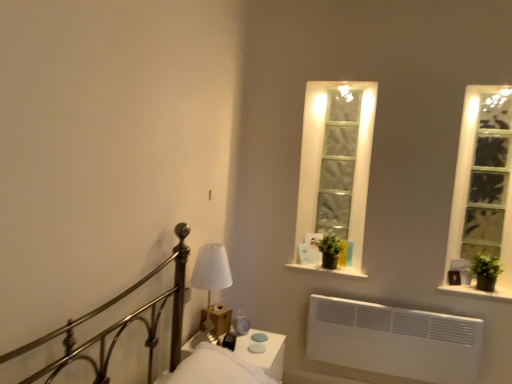
Describe the element at coordinates (479, 291) in the screenshot. I see `green matte plant at right, acting as the second window sill starting from the top` at that location.

How much space does black matte window sill at center, the 1th window sill in the left-to-right sequence, occupy horizontally?

The width of black matte window sill at center, the 1th window sill in the left-to-right sequence, is 11.52 inches.

At what (x,y) coordinates should I click in order to perform the action: click on metallic bed at left. Please return your answer as a coordinate pair (x, y). Looking at the image, I should click on (120, 325).

Is green matte plant at right, the 1th plant from the right, oriented away from green matte plant at right, acting as the second window sill starting from the top?

No, green matte plant at right, the 1th plant from the right, is not facing the opposite direction of green matte plant at right, acting as the second window sill starting from the top.

From the image's perspective, would you say green matte plant at right, which appears as the 2th plant when viewed from the back, is shown under green matte plant at right, which ranks as the 2th window sill in left-to-right order?

No, from the image's perspective, green matte plant at right, which appears as the 2th plant when viewed from the back, is not beneath green matte plant at right, which ranks as the 2th window sill in left-to-right order.

Consider the image. Measure the distance between green matte plant at right, the 1th plant from the right, and green matte plant at right, which is the first window sill in right-to-left order.

3.87 inches.

From a real-world perspective, is green matte plant at right, which appears as the first plant when viewed from the front, physically above green matte plant at right, which ranks as the 2th window sill in left-to-right order?

Yes.

Which of these two, green matte plant at right, the 1th window sill positioned from the bottom, or white fabric lampshade at center, is thinner?

white fabric lampshade at center is thinner.

Based on the photo, looking at the image, does green matte plant at right, which ranks as the 2th window sill in left-to-right order, seem bigger or smaller compared to white fabric lampshade at center?

In the image, green matte plant at right, which ranks as the 2th window sill in left-to-right order, appears to be smaller than white fabric lampshade at center.

Is green matte plant at right, which is the first window sill in right-to-left order, not near white fabric lampshade at center?

Yes.

Considering the relative positions of metallic bed at left and black matte window sill at center, the 1th window sill when ordered from top to bottom, in the image provided, is metallic bed at left to the left or to the right of black matte window sill at center, the 1th window sill when ordered from top to bottom,?

From the image, it's evident that metallic bed at left is to the left of black matte window sill at center, the 1th window sill when ordered from top to bottom.

Locate an element on the screen. The image size is (512, 384). bed below the black matte window sill at center, which appears as the 2th window sill when viewed from the right (from the image's perspective) is located at coordinates (120, 325).

Is point (170, 288) farther from viewer compared to point (364, 274)?

No, it is not.

From the image's perspective, starting from the black matte window sill at center, the 1th window sill in the left-to-right sequence, which plant is the 2nd one above? Please provide its 2D coordinates.

[(332, 251)]

From the image's perspective, who appears lower, black matte window sill at center, the 2th window sill from the bottom, or green matte plant at center, arranged as the second plant when viewed from the front?

black matte window sill at center, the 2th window sill from the bottom, is shown below in the image.

From the picture: Is black matte window sill at center, the 1th window sill when ordered from top to bottom, thinner than green matte plant at center, the first plant positioned from the back?

Incorrect, the width of black matte window sill at center, the 1th window sill when ordered from top to bottom, is not less than that of green matte plant at center, the first plant positioned from the back.

Between black matte window sill at center, the 1th window sill in the left-to-right sequence, and green matte plant at center, arranged as the second plant when viewed from the front, which one has smaller size?

green matte plant at center, arranged as the second plant when viewed from the front, is smaller.

Is metallic bed at left located outside white glossy nightstand at lower center?

Yes, metallic bed at left is located beyond the bounds of white glossy nightstand at lower center.

Is metallic bed at left directly adjacent to white glossy nightstand at lower center?

No.

From the picture: Does metallic bed at left have a smaller size compared to white glossy nightstand at lower center?

Incorrect, metallic bed at left is not smaller in size than white glossy nightstand at lower center.

Does green matte plant at center, arranged as the second plant when viewed from the front, have a smaller size compared to white glossy nightstand at lower center?

Indeed, green matte plant at center, arranged as the second plant when viewed from the front, has a smaller size compared to white glossy nightstand at lower center.

Could you measure the distance between green matte plant at center, the 2th plant viewed from the right, and white glossy nightstand at lower center?

green matte plant at center, the 2th plant viewed from the right, and white glossy nightstand at lower center are 31.70 inches apart from each other.

Which is behind, green matte plant at center, arranged as the second plant when viewed from the front, or white glossy nightstand at lower center?

Positioned behind is green matte plant at center, arranged as the second plant when viewed from the front.

Considering the relative positions of green matte plant at center, arranged as the second plant when viewed from the front, and white glossy nightstand at lower center in the image provided, is green matte plant at center, arranged as the second plant when viewed from the front, to the right of white glossy nightstand at lower center from the viewer's perspective?

Indeed, green matte plant at center, arranged as the second plant when viewed from the front, is positioned on the right side of white glossy nightstand at lower center.

Image resolution: width=512 pixels, height=384 pixels. What are the coordinates of `plant that is the 1st object located below the clear glass window at right (from the image's perspective)` in the screenshot? It's located at (332, 251).

Would you say green matte plant at center, arranged as the second plant when viewed from the front, contains clear glass window at right?

No, clear glass window at right is not inside green matte plant at center, arranged as the second plant when viewed from the front.

Which of these two, green matte plant at center, the 2th plant viewed from the right, or clear glass window at right, is wider?

Wider between the two is clear glass window at right.

From the image's perspective, is green matte plant at center, arranged as the second plant when viewed from the front, under clear glass window at right?

Yes.

You are a GUI agent. You are given a task and a screenshot of the screen. Output one action in this format:
    pyautogui.click(x=<x>, y=<y>)
    Task: Click on the 1st window sill counting from the left of the green matte plant at right, which appears as the first plant when viewed from the front
    
    Given the screenshot: What is the action you would take?
    pyautogui.click(x=479, y=291)

Locate an element on the screen. This screenshot has height=384, width=512. the 2nd window sill to the right of the white fabric lampshade at center, starting your count from the anchor is located at coordinates (479, 291).

Looking at the image, which one is located closer to green matte plant at right, the 1th plant from the right, green matte plant at right, which is the first window sill in right-to-left order, or green matte plant at center, the first plant positioned from the back?

green matte plant at right, which is the first window sill in right-to-left order.

Which object lies further to the anchor point green matte plant at right, which appears as the 2th plant when viewed from the back, green matte plant at center, which is counted as the 1th plant, starting from the left, or metallic bed at left?

Based on the image, metallic bed at left appears to be further to green matte plant at right, which appears as the 2th plant when viewed from the back.

From the image, which object appears to be farther from white fabric lampshade at center, green matte plant at center, the first plant positioned from the back, or clear glass window at right?

clear glass window at right lies further to white fabric lampshade at center than the other object.

Estimate the real-world distances between objects in this image. Which object is closer to green matte plant at right, the 1th plant from the right, clear glass window at right or green matte plant at center, the first plant positioned from the back?

The object closer to green matte plant at right, the 1th plant from the right, is clear glass window at right.

From the image, which object appears to be nearer to green matte plant at right, which appears as the first plant when viewed from the front, green matte plant at right, acting as the second window sill starting from the top, or black matte window sill at center, the 1th window sill in the left-to-right sequence?

green matte plant at right, acting as the second window sill starting from the top, lies closer to green matte plant at right, which appears as the first plant when viewed from the front, than the other object.

In the scene shown: Looking at the image, which one is located further to clear glass window at right, green matte plant at right, which is the first window sill in right-to-left order, or black matte window sill at center, the 2th window sill from the bottom?

black matte window sill at center, the 2th window sill from the bottom, is positioned further to the anchor clear glass window at right.

Looking at this image, estimate the real-world distances between objects in this image. Which object is closer to green matte plant at right, the 1th plant from the right, metallic bed at left or green matte plant at right, acting as the second window sill starting from the top?

Among the two, green matte plant at right, acting as the second window sill starting from the top, is located nearer to green matte plant at right, the 1th plant from the right.

Which object lies nearer to the anchor point metallic bed at left, green matte plant at right, the 1th plant from the right, or clear glass window at right?

clear glass window at right.

The width and height of the screenshot is (512, 384). Find the location of `window sill between black matte window sill at center, which appears as the 2th window sill when viewed from the right, and clear glass window at right`. window sill between black matte window sill at center, which appears as the 2th window sill when viewed from the right, and clear glass window at right is located at coordinates (479, 291).

At what (x,y) coordinates should I click in order to perform the action: click on bedside lamp between metallic bed at left and black matte window sill at center, the 1th window sill in the left-to-right sequence, from front to back. Please return your answer as a coordinate pair (x, y). Image resolution: width=512 pixels, height=384 pixels. Looking at the image, I should click on (211, 272).

You are a GUI agent. You are given a task and a screenshot of the screen. Output one action in this format:
    pyautogui.click(x=<x>, y=<y>)
    Task: Click on the window sill situated between green matte plant at center, which is counted as the 1th plant, starting from the left, and clear glass window at right from left to right
    This screenshot has height=384, width=512.
    Given the screenshot: What is the action you would take?
    [479, 291]

Identify the location of window sill situated between white glossy nightstand at lower center and green matte plant at right, acting as the second window sill starting from the top, from left to right. (330, 269).